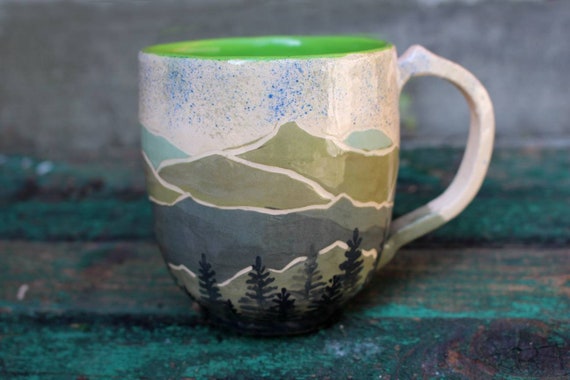
Where is `wood plank`? This screenshot has width=570, height=380. wood plank is located at coordinates click(458, 288), click(504, 215), click(484, 353).